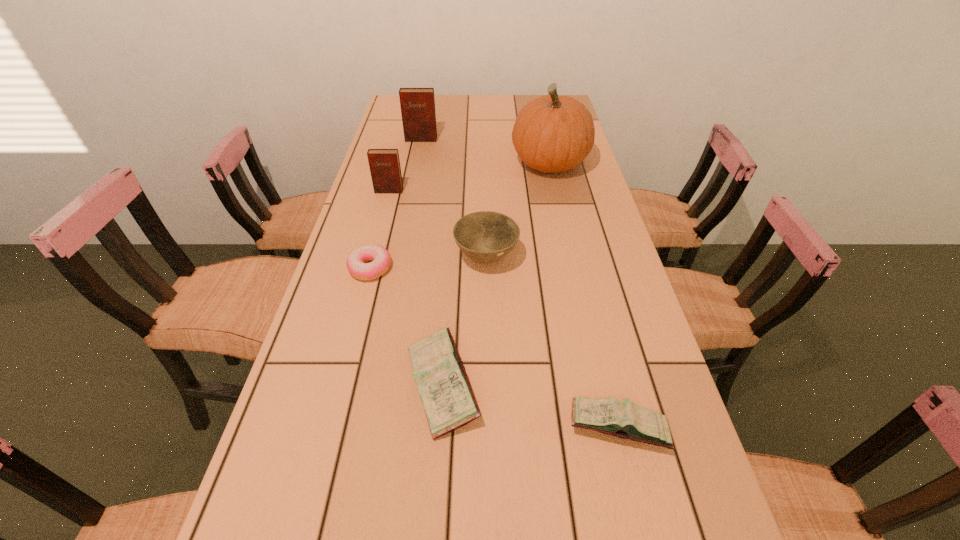
Where is `pumpkin`? The height and width of the screenshot is (540, 960). pumpkin is located at coordinates (552, 133).

Locate an element on the screen. The width and height of the screenshot is (960, 540). the tallest object is located at coordinates (552, 133).

Locate an element on the screen. This screenshot has height=540, width=960. the bigger reddish-brown diary is located at coordinates (417, 105).

Image resolution: width=960 pixels, height=540 pixels. In order to click on the sixth shortest object in this screenshot , I will do [417, 105].

I want to click on the fifth nearest object, so coord(384,164).

This screenshot has height=540, width=960. In order to click on the nearer reddish-brown diary in this screenshot , I will do `click(384, 164)`.

The image size is (960, 540). Identify the location of gray bowl. (486, 236).

Where is `the fourth shortest object`? the fourth shortest object is located at coordinates (486, 236).

Identify the location of the bigger pink diary. (444, 388).

Find the location of a particular element. This screenshot has height=540, width=960. the second shortest diary is located at coordinates (444, 388).